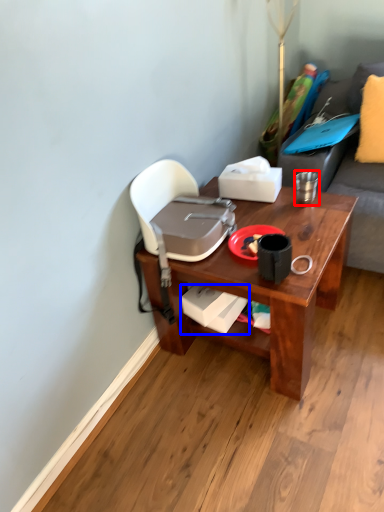
Question: Which object is closer to the camera taking this photo, coffee cup (highlighted by a red box) or box (highlighted by a blue box)?

Choices:
 (A) coffee cup
 (B) box

Answer: (B)